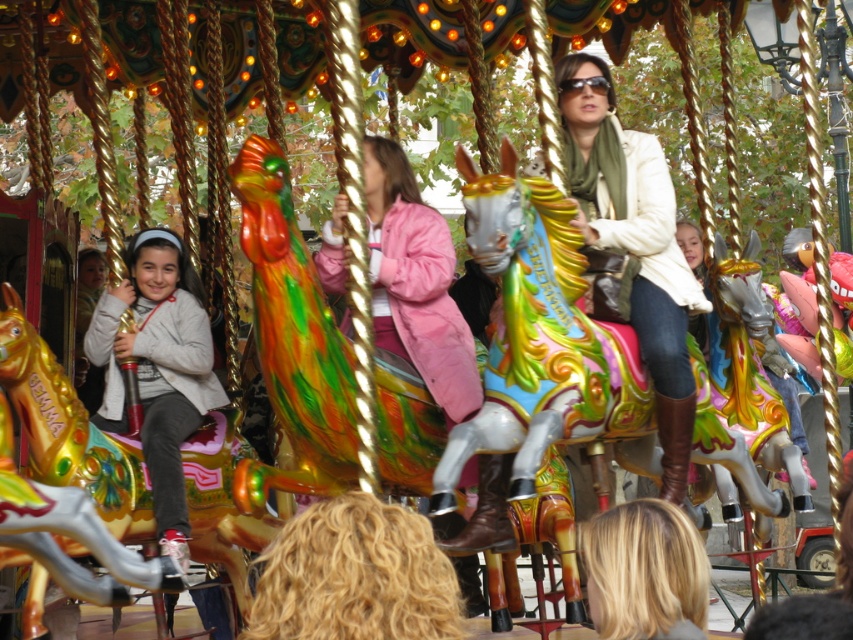
You are a photographer at the carousel and want to capture both the matte white jacket at center and the matte gray jacket at left in the same frame. Which jacket should you focus on first to ensure both are in the frame?

The matte white jacket at center is taller than the matte gray jacket at left, so you should focus on the matte white jacket at center first to ensure both are in the frame.

You are standing at the entrance of the carousel and want to choose between the shiny metallic horse at center and the shiny gold horse at left. Which horse is closer to you?

The shiny gold horse at left is closer to you since it is only 12.61 meters away from the shiny metallic horse at center, but since you are at the entrance, the distance from you to each horse would depend on their positions relative to the entrance. However, based on the given information, the shiny metallic horse at center is farther from the shiny gold horse at left, so the shiny gold horse at left is closer to you.

You are a photographer standing at the edge of the carousel. You want to take a photo that includes both the shiny metallic horse at center and the matte white jacket at center. Which object should you focus on first if you want to ensure both are in clear view?

You should focus on the shiny metallic horse at center first because it is larger than the matte white jacket at center, making it easier to capture clearly.